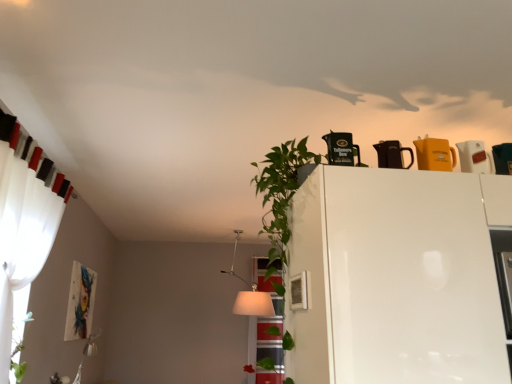
Question: Considering the relative positions of white sheer curtain at left and white glossy pitcher at upper right, placed as the fourth appliance when sorted from left to right, in the image provided, is white sheer curtain at left to the right of white glossy pitcher at upper right, placed as the fourth appliance when sorted from left to right, from the viewer's perspective?

Choices:
 (A) no
 (B) yes

Answer: (A)

Question: Would you say white sheer curtain at left contains white glossy pitcher at upper right, which ranks as the first appliance in right-to-left order?

Choices:
 (A) no
 (B) yes

Answer: (A)

Question: From the image's perspective, is white sheer curtain at left on top of white glossy pitcher at upper right, which ranks as the first appliance in right-to-left order?

Choices:
 (A) yes
 (B) no

Answer: (B)

Question: Is white sheer curtain at left turned away from white glossy pitcher at upper right, placed as the fourth appliance when sorted from left to right?

Choices:
 (A) no
 (B) yes

Answer: (A)

Question: Is white sheer curtain at left not inside white glossy pitcher at upper right, placed as the fourth appliance when sorted from left to right?

Choices:
 (A) no
 (B) yes

Answer: (B)

Question: Is white sheer curtain at left touching white glossy pitcher at upper right, placed as the fourth appliance when sorted from left to right?

Choices:
 (A) no
 (B) yes

Answer: (A)

Question: From the image's perspective, would you say white fabric lampshade at center is positioned over white sheer curtain at left?

Choices:
 (A) yes
 (B) no

Answer: (B)

Question: Is white fabric lampshade at center thinner than white sheer curtain at left?

Choices:
 (A) no
 (B) yes

Answer: (A)

Question: Is white fabric lampshade at center taller than white sheer curtain at left?

Choices:
 (A) no
 (B) yes

Answer: (A)

Question: Does white fabric lampshade at center turn towards white sheer curtain at left?

Choices:
 (A) yes
 (B) no

Answer: (B)

Question: Is white fabric lampshade at center far from white sheer curtain at left?

Choices:
 (A) yes
 (B) no

Answer: (A)

Question: Could white sheer curtain at left be considered to be inside white fabric lampshade at center?

Choices:
 (A) yes
 (B) no

Answer: (B)

Question: Considering the relative positions of white glossy fridge at upper center and white sheer curtain at left in the image provided, is white glossy fridge at upper center to the right of white sheer curtain at left from the viewer's perspective?

Choices:
 (A) no
 (B) yes

Answer: (B)